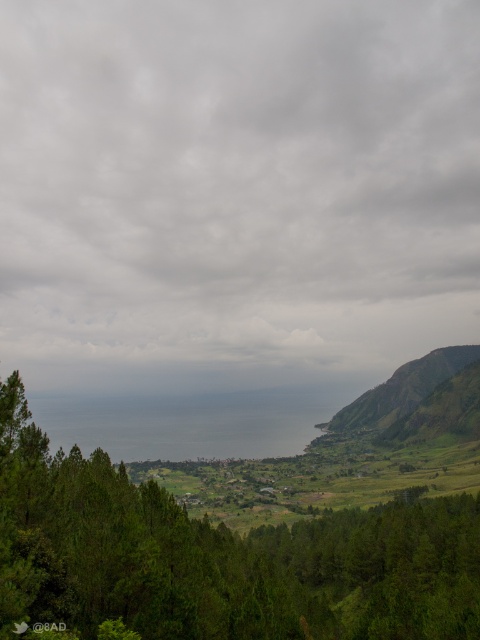
You are an artist planning to paint the coastal landscape. You need to decide which area to focus on first based on their sizes. Which object should you paint first, the cloudy sky at upper center or the green leafy trees at lower left?

The cloudy sky at upper center is larger in size than the green leafy trees at lower left, so you should paint the cloudy sky at upper center first to establish the background before moving to smaller foreground elements.